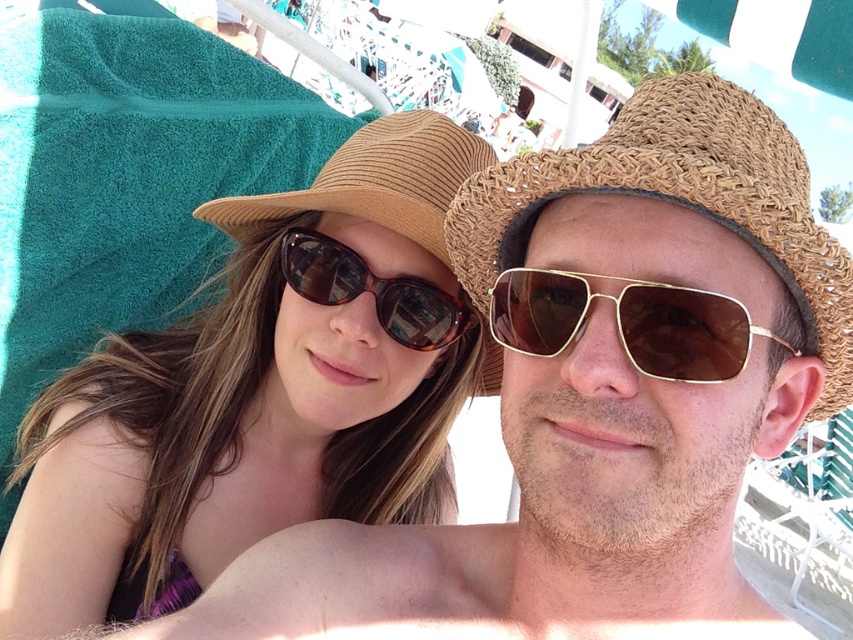
Which of these two, matte brown hat at upper left or gold metallic aviator sunglasses at center, stands taller?

Standing taller between the two is matte brown hat at upper left.

Is matte brown hat at upper left shorter than gold metallic aviator sunglasses at center?

No.

Image resolution: width=853 pixels, height=640 pixels. In order to click on matte brown hat at upper left in this screenshot , I will do `click(258, 394)`.

Who is taller, woven straw hat at center or brown tortoiseshell sunglasses at center?

woven straw hat at center is taller.

Based on the photo, does woven straw hat at center appear under brown tortoiseshell sunglasses at center?

No.

Between point (770, 218) and point (357, 275), which one is positioned in front?

Positioned in front is point (770, 218).

At what (x,y) coordinates should I click in order to perform the action: click on woven straw hat at center. Please return your answer as a coordinate pair (x, y). The image size is (853, 640). Looking at the image, I should click on (677, 202).

Does woven straw hat at center appear under gold metallic aviator sunglasses at center?

Actually, woven straw hat at center is above gold metallic aviator sunglasses at center.

Is the position of woven straw hat at center less distant than that of gold metallic aviator sunglasses at center?

Yes, it is in front of gold metallic aviator sunglasses at center.

Which is behind, point (664, 118) or point (730, 362)?

Positioned behind is point (664, 118).

Locate an element on the screen. woven straw hat at center is located at coordinates (677, 202).